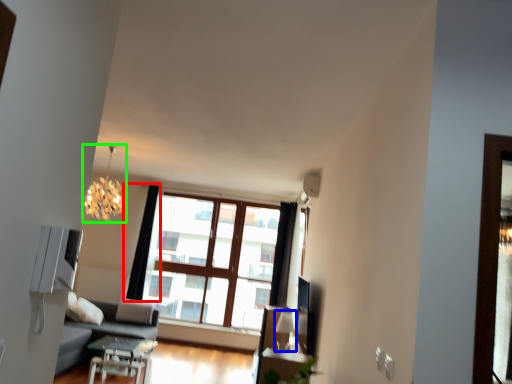
Question: Estimate the real-world distances between objects in this image. Which object is closer to curtain (highlighted by a red box), lamp (highlighted by a blue box) or lamp (highlighted by a green box)?

Choices:
 (A) lamp
 (B) lamp

Answer: (B)